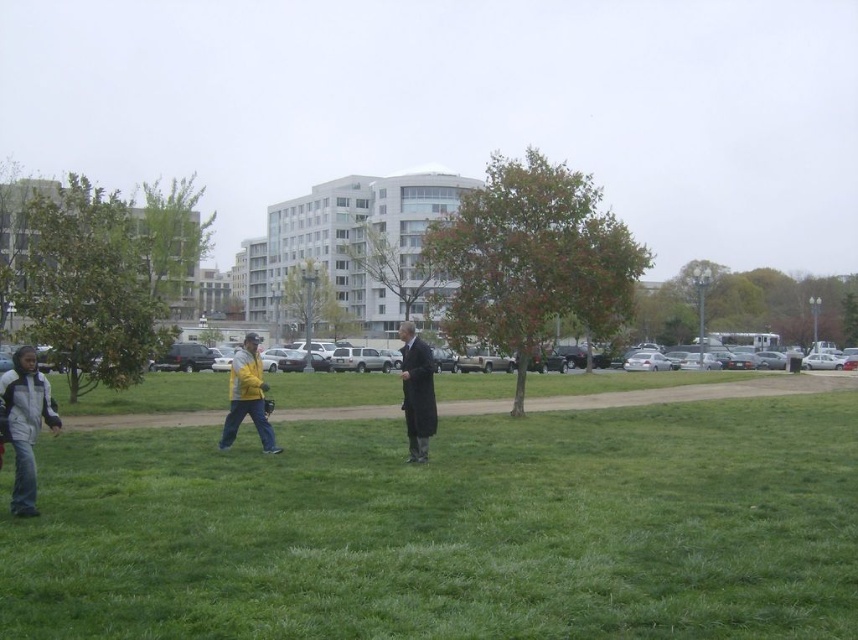
You are standing at the edge of the green grass at center and want to reach the dark gray wool coat at center. Which direction should you move to get closer to the coat?

The dark gray wool coat at center is further away from the viewer compared to the green grass at center. To reach it, you should move forward away from the green grass at center towards the coat.

You are standing on the green grass at center and want to throw a ball to someone standing at the dark gray wool coat at center. If your throwing range is 4 meters, can you reach them?

The distance between the green grass at center and the dark gray wool coat at center is 4.05 meters, which is slightly beyond your 4 meter throwing range. You cannot reach them with this throw.